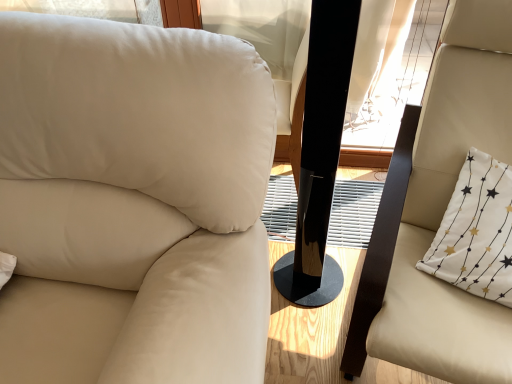
Question: Looking at their shapes, would you say beige leather chair at right, the 1th chair viewed from the right, is wider or thinner than black glossy speaker at center?

Choices:
 (A) thin
 (B) wide

Answer: (B)

Question: From a real-world perspective, is beige leather chair at right, the 2th chair positioned from the left, above or below black glossy speaker at center?

Choices:
 (A) above
 (B) below

Answer: (A)

Question: Which object is the closest to the beige leather chair at left, which is counted as the 1th chair, starting from the left?

Choices:
 (A) black glossy speaker at center
 (B) beige leather chair at right, the 1th chair viewed from the right
 (C) white fabric pillow at right

Answer: (A)

Question: Which of these objects is positioned closest to the white fabric pillow at right?

Choices:
 (A) beige leather chair at right, the 1th chair viewed from the right
 (B) black glossy speaker at center
 (C) beige leather chair at left, placed as the 2th chair when sorted from right to left

Answer: (A)